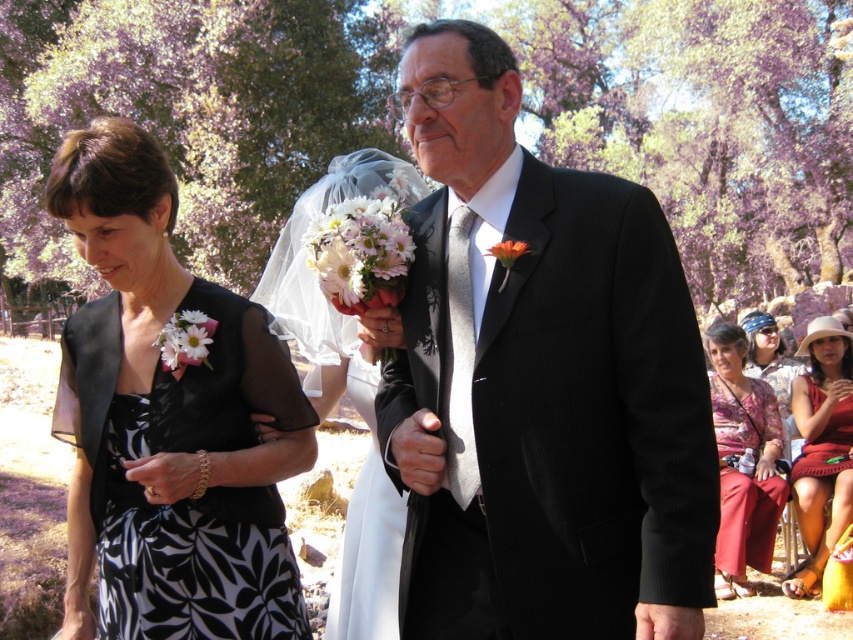
Who is taller, white matte bouquet at center or orange matte flower at center?

With more height is white matte bouquet at center.

Which is more to the left, white matte bouquet at center or orange matte flower at center?

Positioned to the left is white matte bouquet at center.

Identify the location of white matte bouquet at center. Image resolution: width=853 pixels, height=640 pixels. (360, 253).

At what (x,y) coordinates should I click in order to perform the action: click on white matte bouquet at center. Please return your answer as a coordinate pair (x, y). The width and height of the screenshot is (853, 640). Looking at the image, I should click on pos(360,253).

Is the position of white satin veil at center less distant than that of white matte flower at lower left?

That is False.

Measure the distance from white satin veil at center to white matte flower at lower left.

white satin veil at center is 26.97 inches from white matte flower at lower left.

Between point (285, 292) and point (167, 333), which one is positioned in front?

Positioned in front is point (167, 333).

You are a GUI agent. You are given a task and a screenshot of the screen. Output one action in this format:
    pyautogui.click(x=<x>, y=<y>)
    Task: Click on the white satin veil at center
    
    Given the screenshot: What is the action you would take?
    pyautogui.click(x=345, y=388)

Between matte red dress at lower right and white matte bouquet at center, which one is positioned lower?

matte red dress at lower right is below.

Who is more distant from viewer, (834,346) or (320,266)?

The point (834,346) is behind.

Where is `matte red dress at lower right`? The height and width of the screenshot is (640, 853). matte red dress at lower right is located at coordinates (821, 449).